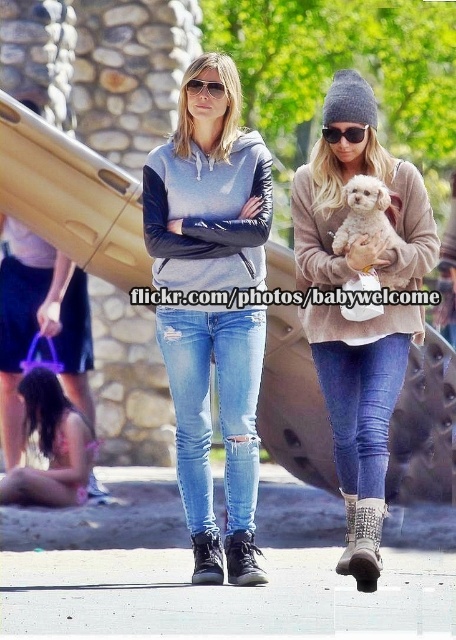
Question: Which point is farther to the camera?

Choices:
 (A) (373, 202)
 (B) (382, 419)

Answer: (A)

Question: Is denim jeans at lower center closer to camera compared to light pink fabric bikini at lower left?

Choices:
 (A) no
 (B) yes

Answer: (B)

Question: Which point appears closest to the camera in this image?

Choices:
 (A) (392, 244)
 (B) (207, 214)
 (C) (378, 144)

Answer: (A)

Question: Does beige soft sweater at upper right appear over sunglasses at center?

Choices:
 (A) no
 (B) yes

Answer: (A)

Question: Does denim jeans at lower center come behind sunglasses at center?

Choices:
 (A) yes
 (B) no

Answer: (B)

Question: Which point is closer to the camera?

Choices:
 (A) gray hoodie with leather sleeves at center
 (B) sunglasses at center
 (C) white fluffy dog at center

Answer: (C)